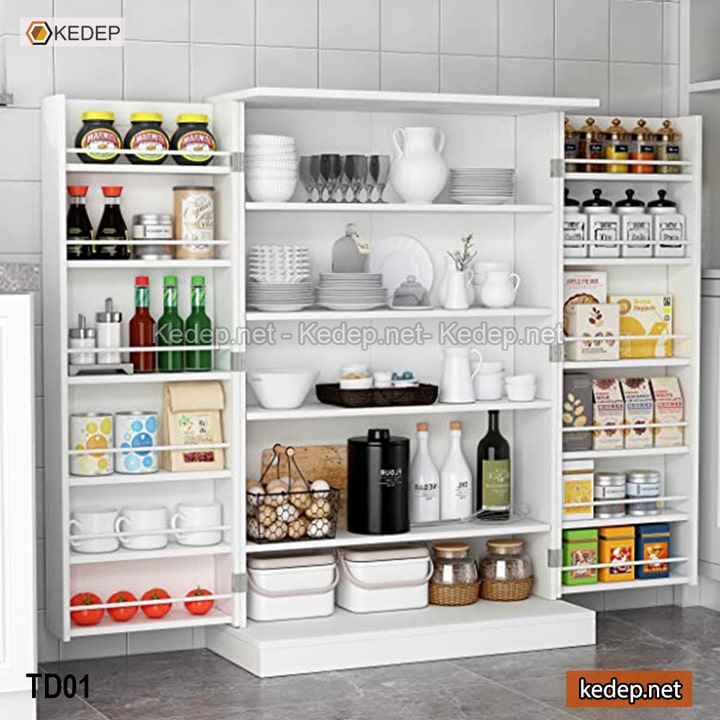
Where is `decorative cannisers`? decorative cannisers is located at coordinates (574, 227), (600, 225), (628, 228), (667, 225), (669, 145), (651, 145), (624, 145), (590, 150), (562, 150).